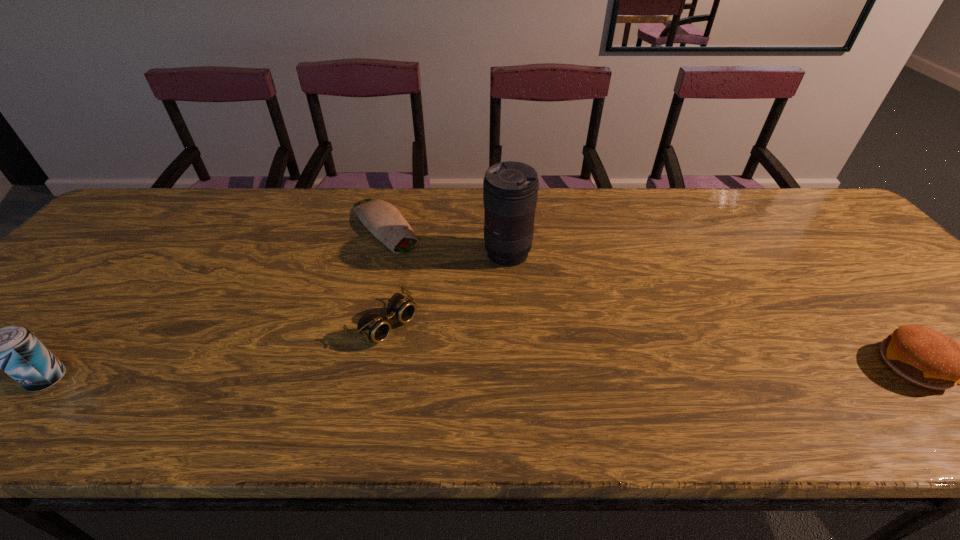
Where is `vacant region at the far edge of the desktop`? The image size is (960, 540). vacant region at the far edge of the desktop is located at coordinates (197, 234).

In order to click on free space at the near edge of the desktop in this screenshot , I will do `click(304, 389)`.

Identify the location of free space at the left edge of the desktop. This screenshot has width=960, height=540. (33, 316).

Locate an element on the screen. Image resolution: width=960 pixels, height=540 pixels. vacant space at the right edge is located at coordinates (817, 237).

Locate an element on the screen. The image size is (960, 540). vacant space at the far left corner of the desktop is located at coordinates (147, 220).

The image size is (960, 540). I want to click on free space that is in between the goggles and the leftmost object, so click(x=216, y=351).

Identify the location of unoccupied area between the goggles and the telephoto lens. The height and width of the screenshot is (540, 960). point(445,288).

Find the location of a particular element. vacant region between the beer can and the tallest object is located at coordinates pos(277,316).

Identify the location of vacant region between the goggles and the second object from right to left. This screenshot has height=540, width=960. (445, 288).

At what (x,y) coordinates should I click in order to perform the action: click on unoccupied area between the leftmost object and the second object from right to left. Please return your answer as a coordinate pair (x, y). This screenshot has height=540, width=960. Looking at the image, I should click on (277, 316).